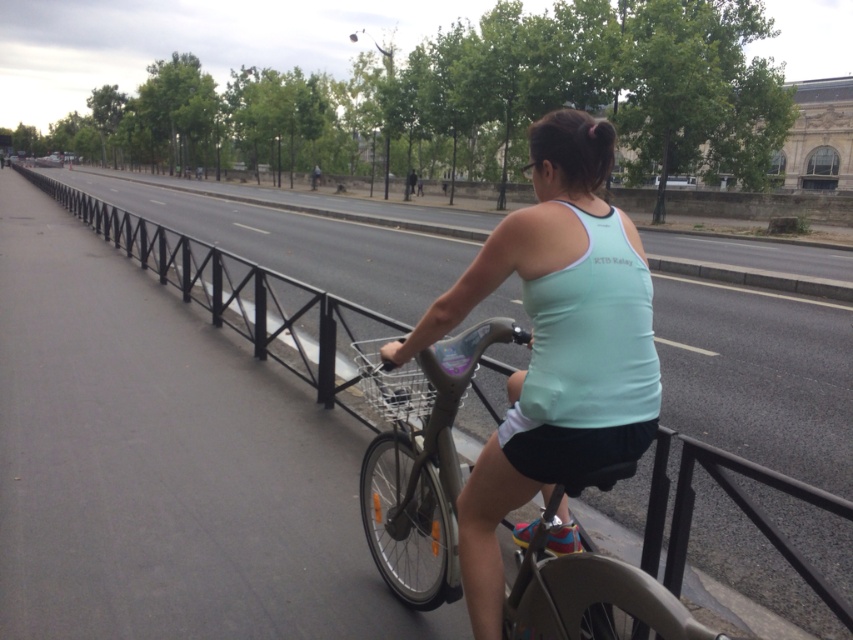
Question: Can you confirm if light blue fabric tank top at center is thinner than black metal rail at center?

Choices:
 (A) yes
 (B) no

Answer: (A)

Question: Is light blue fabric tank top at center smaller than black metal rail at center?

Choices:
 (A) no
 (B) yes

Answer: (B)

Question: Among these points, which one is nearest to the camera?

Choices:
 (A) (689, 509)
 (B) (413, 339)

Answer: (B)

Question: Does light blue fabric tank top at center come behind black metal rail at center?

Choices:
 (A) yes
 (B) no

Answer: (B)

Question: Among these points, which one is nearest to the camera?

Choices:
 (A) [x=339, y=298]
 (B) [x=583, y=307]

Answer: (B)